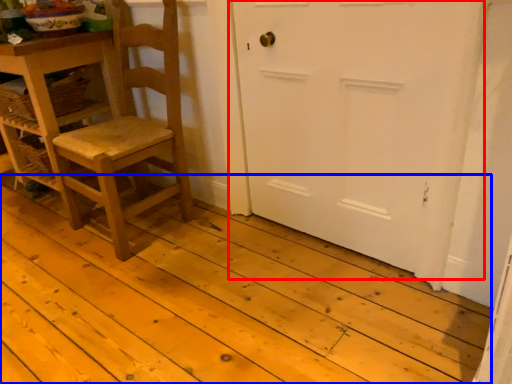
Question: Which object appears closest to the camera in this image, door (highlighted by a red box) or plank (highlighted by a blue box)?

Choices:
 (A) door
 (B) plank

Answer: (B)